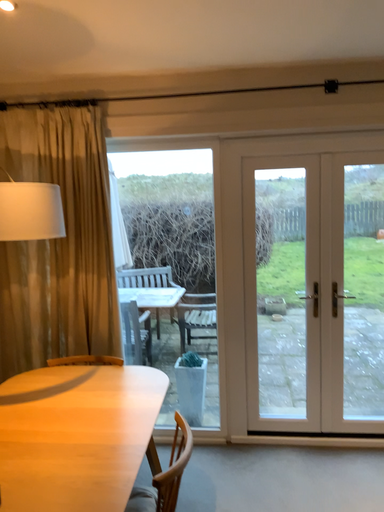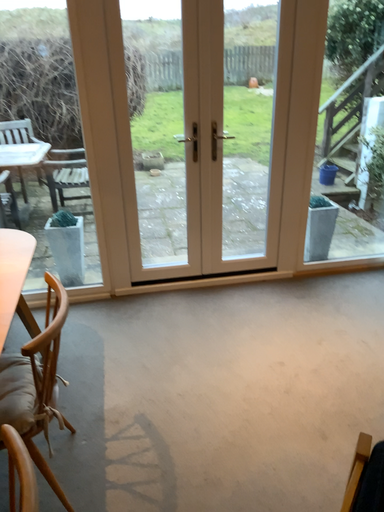
Question: How did the camera likely rotate when shooting the video?

Choices:
 (A) rotated right
 (B) rotated left

Answer: (A)